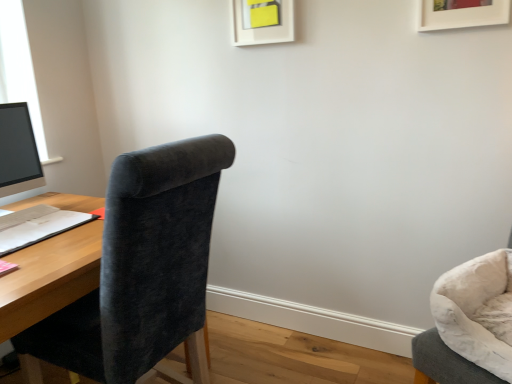
Question: Should I look upward or downward to see velvet dark gray chair at left, the second chair from the right?

Choices:
 (A) up
 (B) down

Answer: (B)

Question: Does white matte picture frame at upper center, the second picture frame positioned from the front, appear on the right side of velvet dark gray chair at left, the first chair viewed from the left?

Choices:
 (A) yes
 (B) no

Answer: (A)

Question: Does white matte picture frame at upper center, the second picture frame positioned from the front, have a greater width compared to velvet dark gray chair at left, the second chair from the right?

Choices:
 (A) yes
 (B) no

Answer: (B)

Question: Is white matte picture frame at upper center, the 1th picture frame viewed from the back, located outside velvet dark gray chair at left, the first chair viewed from the left?

Choices:
 (A) no
 (B) yes

Answer: (B)

Question: Is white matte picture frame at upper center, placed as the 1th picture frame when sorted from left to right, far from velvet dark gray chair at left, the first chair viewed from the left?

Choices:
 (A) yes
 (B) no

Answer: (A)

Question: From a real-world perspective, is white matte picture frame at upper center, positioned as the second picture frame in right-to-left order, beneath velvet dark gray chair at left, the first chair viewed from the left?

Choices:
 (A) yes
 (B) no

Answer: (B)

Question: Is the position of white matte picture frame at upper center, the 1th picture frame viewed from the back, less distant than that of velvet dark gray chair at left, the first chair viewed from the left?

Choices:
 (A) no
 (B) yes

Answer: (A)

Question: Is matte black monitor at left not near white matte picture frame at upper right, the 1th picture frame viewed from the right?

Choices:
 (A) no
 (B) yes

Answer: (B)

Question: From a real-world perspective, is matte black monitor at left on top of white matte picture frame at upper right, the 1th picture frame viewed from the right?

Choices:
 (A) no
 (B) yes

Answer: (A)

Question: From the image's perspective, does matte black monitor at left appear higher than white matte picture frame at upper right, the 2th picture frame positioned from the left?

Choices:
 (A) yes
 (B) no

Answer: (B)

Question: Are matte black monitor at left and white matte picture frame at upper right, which appears as the second picture frame when viewed from the back, beside each other?

Choices:
 (A) yes
 (B) no

Answer: (B)

Question: Is matte black monitor at left further to camera compared to white matte picture frame at upper right, the 1th picture frame viewed from the right?

Choices:
 (A) no
 (B) yes

Answer: (B)

Question: Is matte black monitor at left positioned in front of white matte picture frame at upper right, the 1th picture frame viewed from the right?

Choices:
 (A) yes
 (B) no

Answer: (B)

Question: Can you confirm if matte black monitor at left is wider than velvet grey chair at right, placed as the 1th chair when sorted from right to left?

Choices:
 (A) no
 (B) yes

Answer: (A)